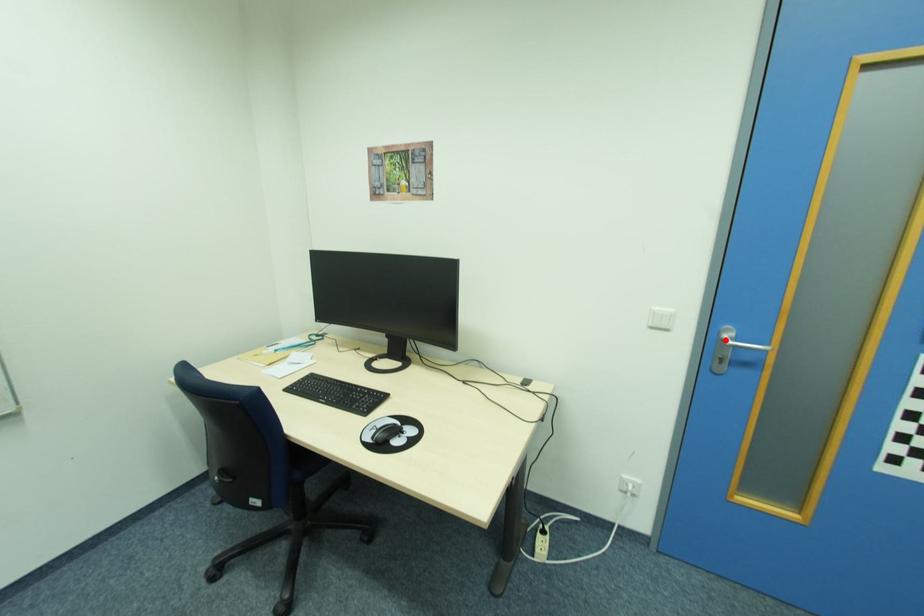
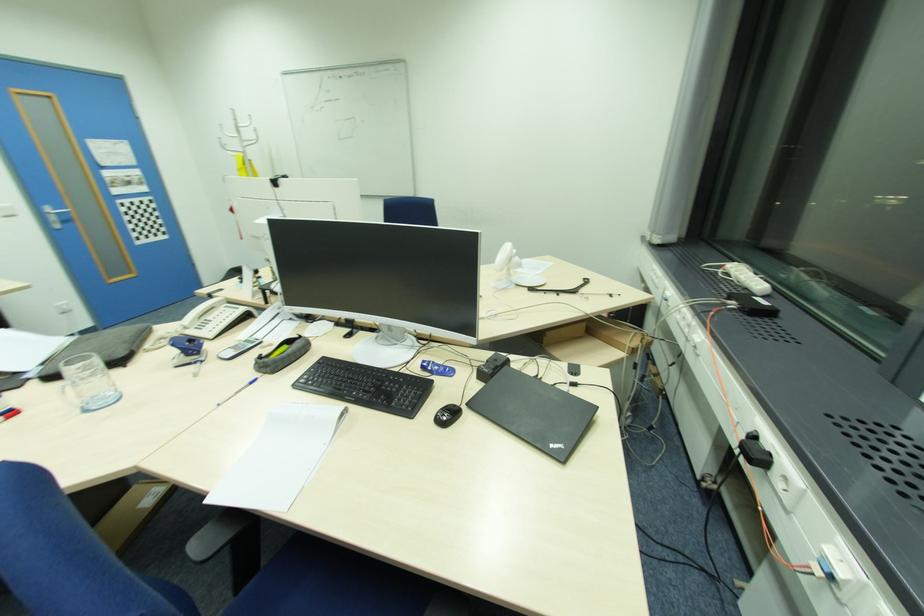
Locate, in the second image, the point that corresponds to the highlighted location in the first image.

(54, 213)